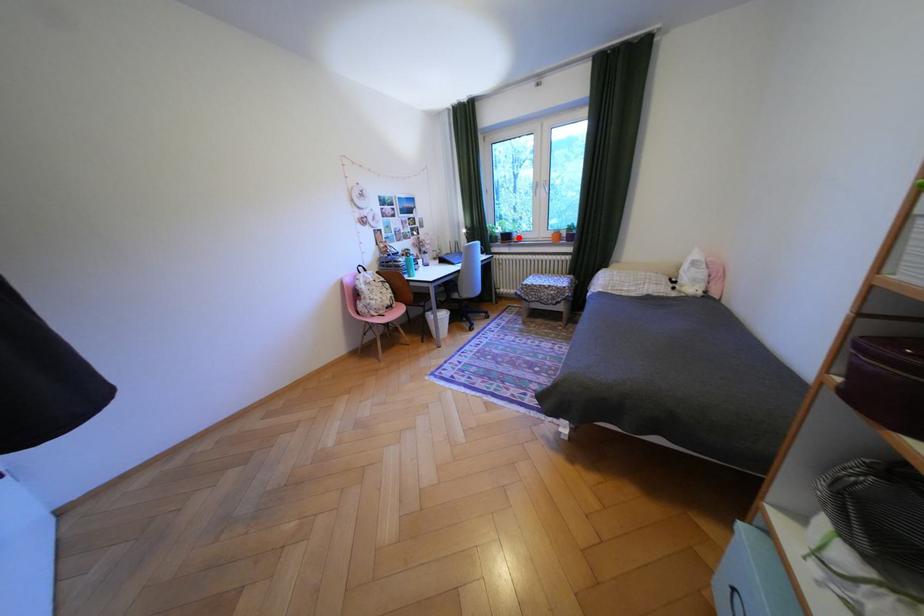
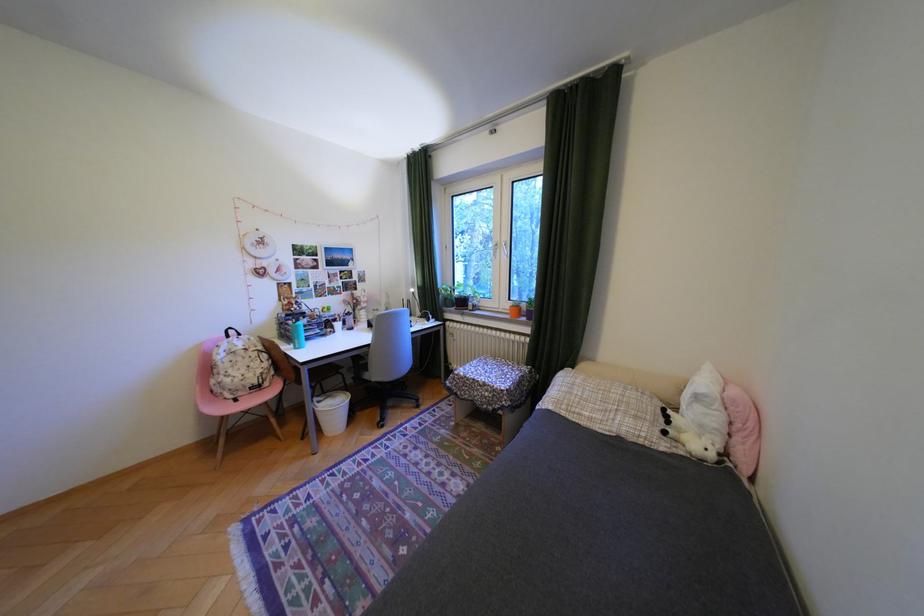
Question: A red point is marked in image1. In image2, is the corresponding 3D point closer to the camera or farther? Reply with the corresponding letter.

Choices:
 (A) The corresponding 3D point is closer.
 (B) The corresponding 3D point is farther.

Answer: (B)